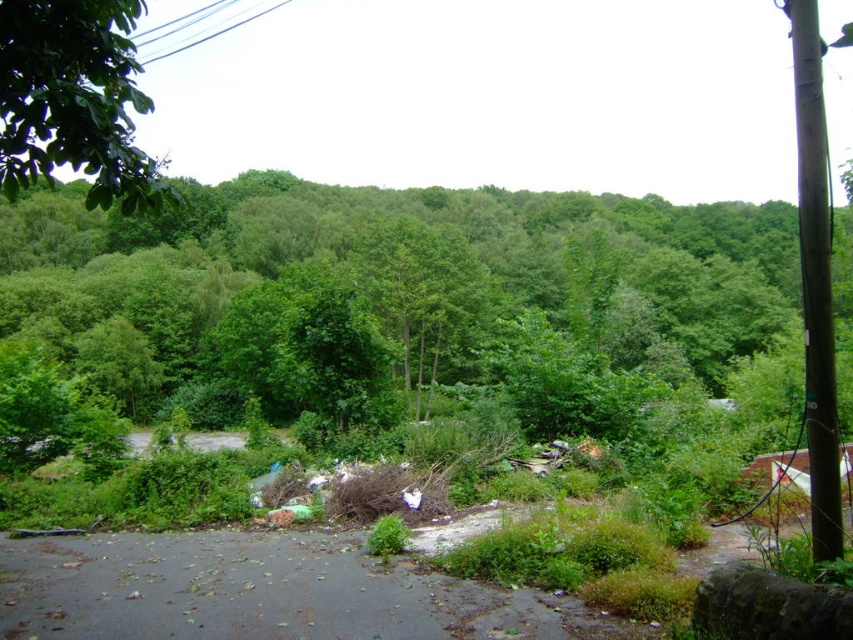
Question: Does brown wood pole at right appear on the right side of black wire at upper left?

Choices:
 (A) no
 (B) yes

Answer: (B)

Question: Which object is the farthest from the black wire at upper left?

Choices:
 (A) green leafy tree at upper left
 (B) brown wood pole at right

Answer: (A)

Question: Which object is farther from the camera taking this photo?

Choices:
 (A) black wire at upper left
 (B) green leafy tree at upper left

Answer: (A)

Question: Estimate the real-world distances between objects in this image. Which object is closer to the black wire at upper left?

Choices:
 (A) brown wood pole at right
 (B) green leafy tree at upper left

Answer: (A)

Question: Does green leafy tree at upper left have a smaller size compared to black wire at upper left?

Choices:
 (A) no
 (B) yes

Answer: (B)

Question: Does green leafy tree at upper left appear on the right side of brown wood pole at right?

Choices:
 (A) yes
 (B) no

Answer: (B)